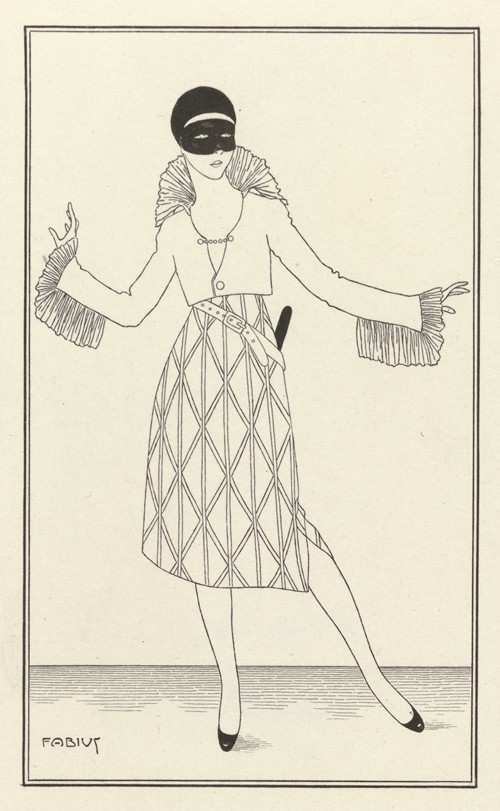
Find the location of `floor`. floor is located at coordinates (278, 700).